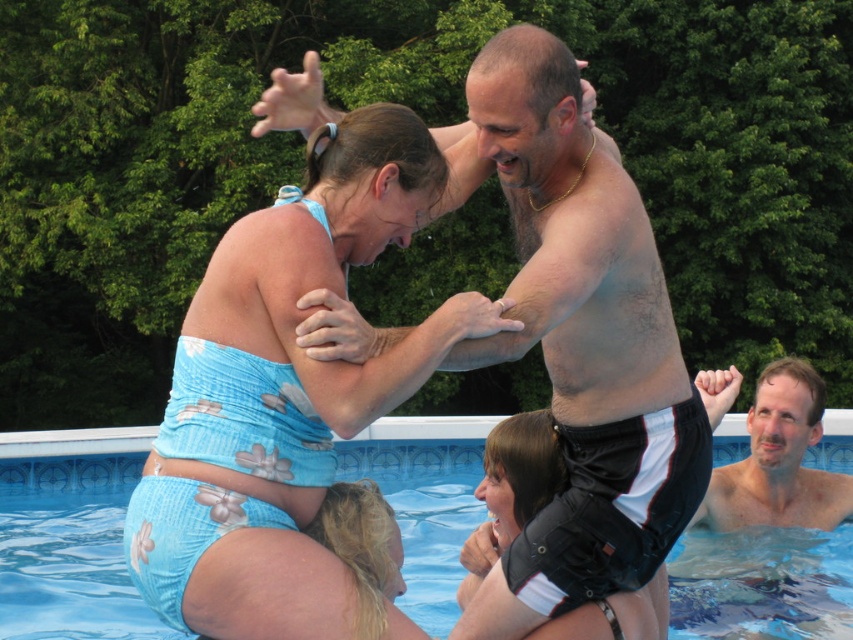
You are a photographer at the pool party and want to capture a photo of the blue floral swimsuit at upper center and the shiny metallic arm at upper center. Which object is located to the left of the other?

The blue floral swimsuit at upper center is positioned on the left side of shiny metallic arm at upper center.

You are a photographer at the pool party and want to capture a photo of both the shiny metallic arm at upper center and the smooth skin man at upper right. Based on their positions, which object is located to the left of the other?

The shiny metallic arm at upper center is positioned on the left side of smooth skin man at upper right, so the shiny metallic arm at upper center is to the left of the smooth skin man at upper right.